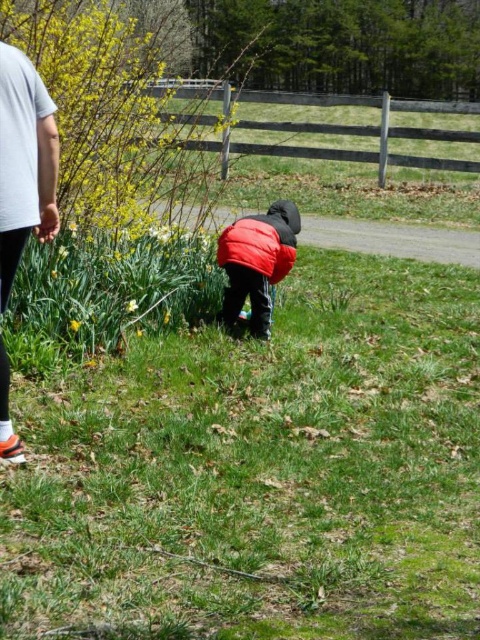
You are the child in the scene wearing the matte red jacket at center. You want to wave to the person in the white cotton shirt at upper left. Which direction should you turn your head to look at them?

The white cotton shirt at upper left is to the left of matte red jacket at center, so you should turn your head to the left to look at them.

Based on the photo, you are standing at the center of the image and want to walk straight to the white cotton shirt at upper left. Is the point where you will arrive at the same location as point (24, 163)?

Yes, because the white cotton shirt at upper left is located exactly at point (24, 163).